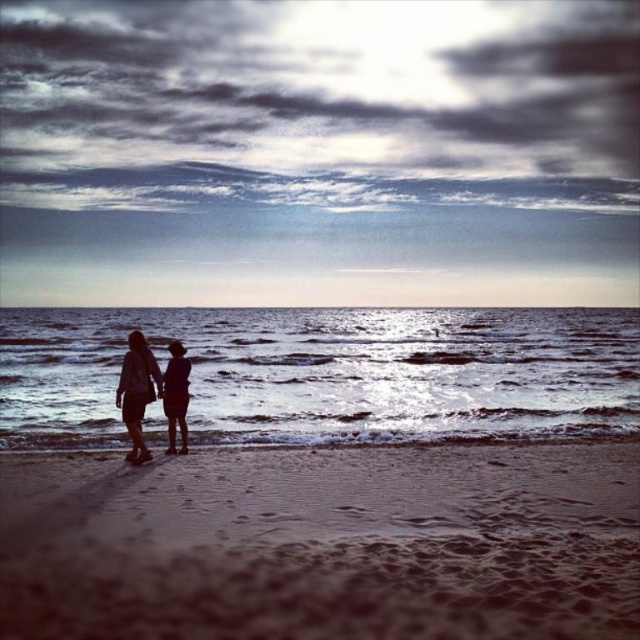
Between shiny silver water at center and silhouette fabric couple at center, which one appears on the right side from the viewer's perspective?

Positioned to the right is silhouette fabric couple at center.

Is shiny silver water at center wider than silhouette fabric couple at center?

Correct, the width of shiny silver water at center exceeds that of silhouette fabric couple at center.

What are the coordinates of `shiny silver water at center` in the screenshot? It's located at (326, 372).

This screenshot has width=640, height=640. I want to click on shiny silver water at center, so click(326, 372).

Which is below, brown sandy beach at lower center or silhouette fabric couple at center?

brown sandy beach at lower center is lower down.

Is brown sandy beach at lower center above silhouette fabric couple at center?

No, brown sandy beach at lower center is not above silhouette fabric couple at center.

Who is more forward, (x=1, y=460) or (x=177, y=406)?

Point (x=1, y=460)

Image resolution: width=640 pixels, height=640 pixels. In order to click on brown sandy beach at lower center in this screenshot , I will do `click(324, 544)`.

Is brown sandy beach at lower center below shiny silver water at center?

Yes.

Does point (548, 570) lie behind point (429, 381)?

No, (548, 570) is closer to viewer.

Locate an element on the screen. brown sandy beach at lower center is located at coordinates click(x=324, y=544).